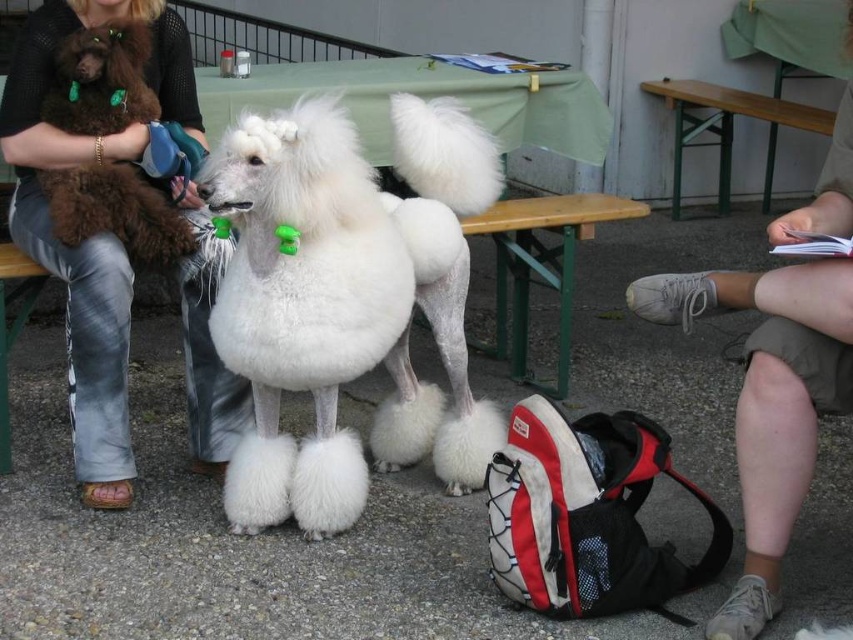
Who is more distant from viewer, (90,88) or (656,83)?

The point (656,83) is more distant.

Between shiny brown fur at left and green painted wood picnic table at upper right, which one is positioned lower?

Positioned lower is shiny brown fur at left.

Is point (57, 72) in front of point (677, 188)?

Yes, it is.

The image size is (853, 640). What are the coordinates of `shiny brown fur at left` in the screenshot? It's located at (117, 211).

Who is more forward, [480,129] or [816,109]?

Point [480,129] is in front.

Can you confirm if white fluffy dog at center is wider than green painted wood picnic table at upper right?

Incorrect, white fluffy dog at center's width does not surpass green painted wood picnic table at upper right's.

Which is behind, point (320, 179) or point (809, 106)?

The point (809, 106) is more distant.

Identify the location of white fluffy dog at center. The width and height of the screenshot is (853, 640). (x=346, y=300).

Can you confirm if white fluffy dog at center is thinner than light brown shorts at lower right?

No.

Is white fluffy dog at center shorter than light brown shorts at lower right?

Yes.

Which is in front, point (223, 486) or point (831, 224)?

Positioned in front is point (831, 224).

In order to click on white fluffy dog at center in this screenshot , I will do `click(346, 300)`.